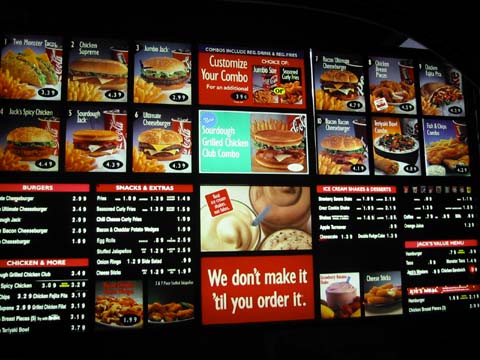
You are a GUI agent. You are given a task and a screenshot of the screen. Output one action in this format:
    pyautogui.click(x=<x>, y=<y>)
    Task: Click on the pictures on the top one row
    The width and height of the screenshot is (480, 360).
    Given the screenshot: What is the action you would take?
    pyautogui.click(x=437, y=96), pyautogui.click(x=390, y=90), pyautogui.click(x=339, y=83), pyautogui.click(x=270, y=85), pyautogui.click(x=167, y=84), pyautogui.click(x=103, y=82), pyautogui.click(x=34, y=79)